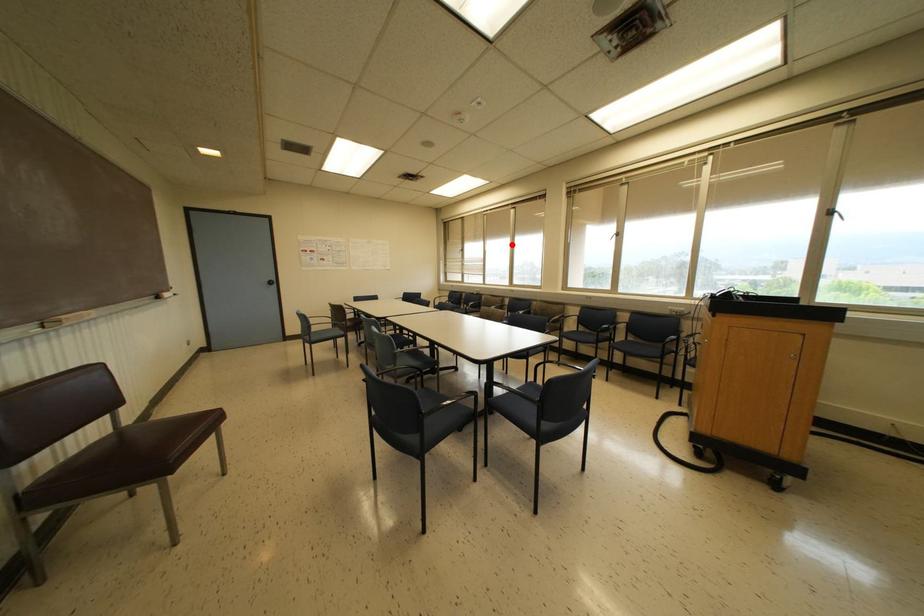
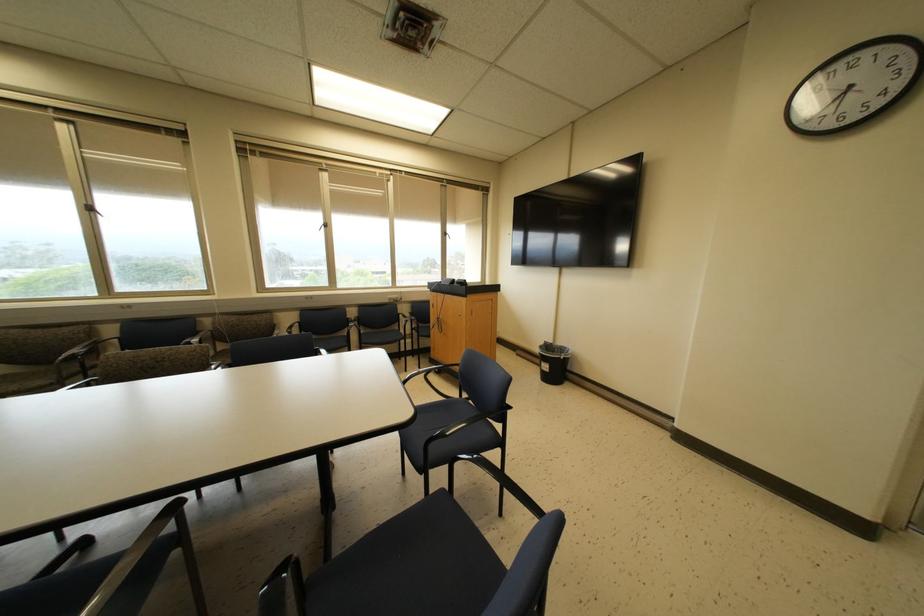
Question: I am providing you with two images of the same scene from different viewpoints. Image1 has a red point marked. In image2, the corresponding 3D location appears at what relative position? Reply with the corresponding letter.

Choices:
 (A) Closer
 (B) Farther

Answer: (B)